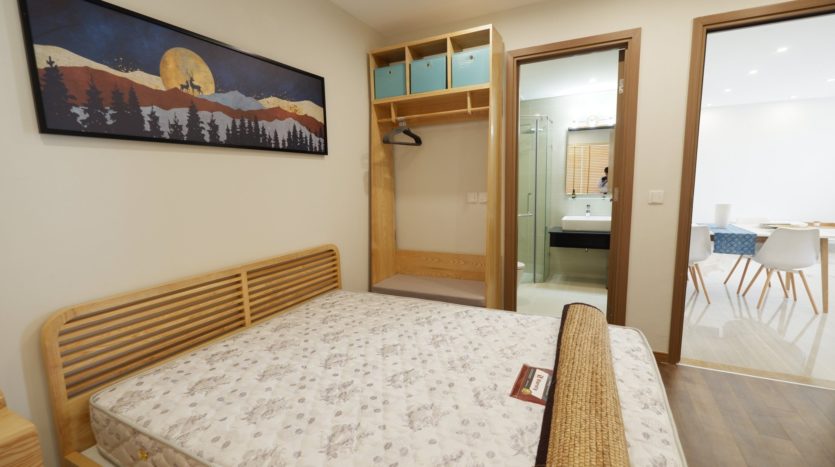
Where is `table leg`? The width and height of the screenshot is (835, 467). table leg is located at coordinates (826, 271).